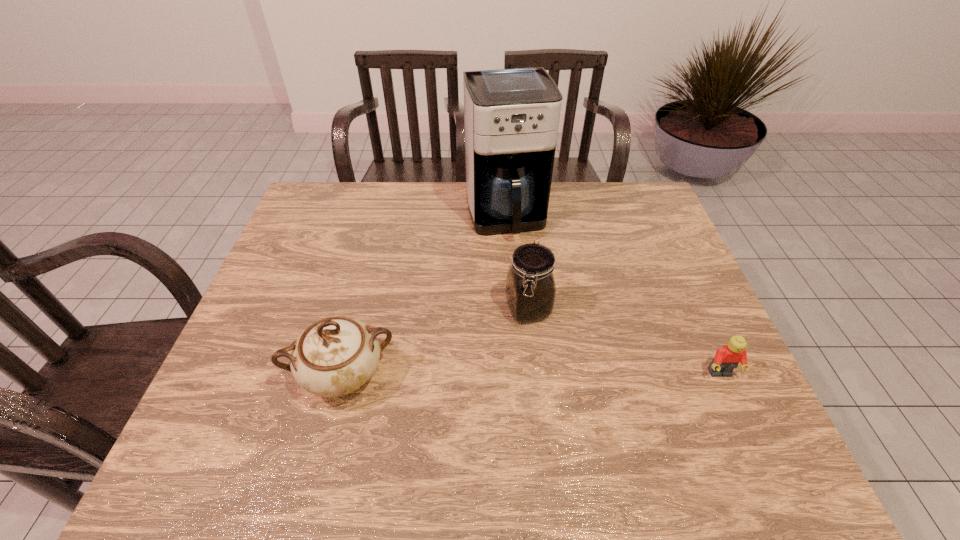
Where is `chinaware`? Image resolution: width=960 pixels, height=540 pixels. chinaware is located at coordinates (335, 356).

I want to click on the shortest object, so click(x=727, y=358).

Locate an element on the screen. This screenshot has width=960, height=540. Lego is located at coordinates (727, 358).

You are a GUI agent. You are given a task and a screenshot of the screen. Output one action in this format:
    pyautogui.click(x=<x>, y=<y>)
    Task: Click on the tallest object
    Image resolution: width=960 pixels, height=540 pixels.
    Given the screenshot: What is the action you would take?
    pyautogui.click(x=511, y=116)

This screenshot has height=540, width=960. I want to click on the farthest object, so 511,116.

The image size is (960, 540). I want to click on the third nearest object, so click(x=530, y=286).

Where is `vacant position located 0.050m on the left of the chinaware`? vacant position located 0.050m on the left of the chinaware is located at coordinates pos(271,375).

Locate an element on the screen. This screenshot has width=960, height=540. vacant space located 0.060m on the face of the rightmost object is located at coordinates (734, 407).

What are the coordinates of `free space located on the front panel of the coffee maker` in the screenshot? It's located at (530, 300).

Locate an element on the screen. This screenshot has width=960, height=540. vacant space situated 0.350m on the front panel of the coffee maker is located at coordinates (542, 340).